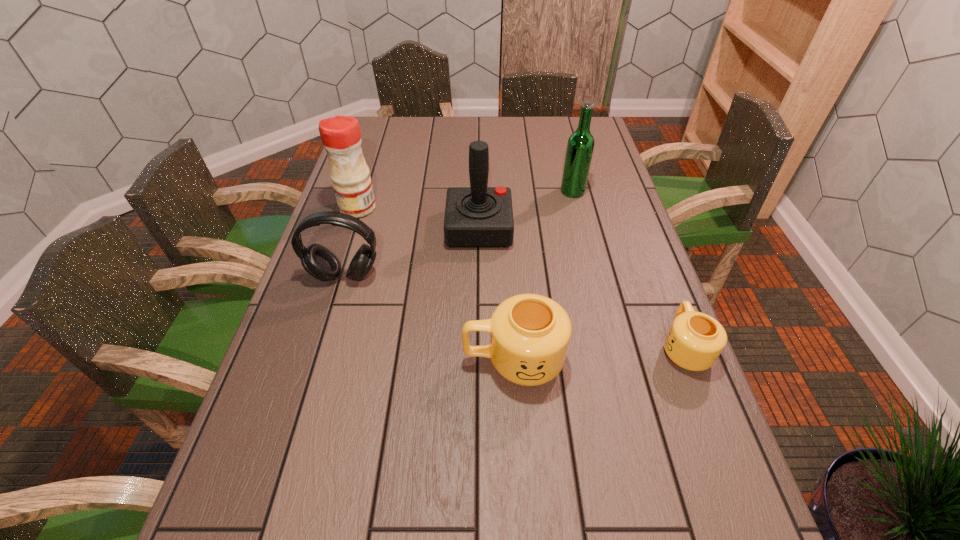
Image resolution: width=960 pixels, height=540 pixels. Identify the location of vacant space that is in between the joystick and the left mug. (496, 294).

Identify the location of vacant area that lies between the condiment and the second shortest object. (436, 284).

The height and width of the screenshot is (540, 960). I want to click on vacant point located between the joystick and the shortest object, so click(582, 288).

The height and width of the screenshot is (540, 960). I want to click on free space between the beer bottle and the rightmost object, so click(628, 269).

What are the coordinates of `free space that is in between the joystick and the fourth farthest object` in the screenshot? It's located at (412, 252).

What are the coordinates of `vacant area that lies between the taller mug and the condiment` in the screenshot? It's located at (436, 284).

Where is `empty space between the condiment and the headset`? This screenshot has width=960, height=540. empty space between the condiment and the headset is located at coordinates (351, 242).

Select which object is the third closest to the joystick. Please provide its 2D coordinates. Your answer should be formatted as a tuple, i.e. [(x, y)], where the tuple contains the x and y coordinates of a point satisfying the conditions above.

[(341, 137)]

Choose which object is the second nearest neighbor to the taller mug. Please provide its 2D coordinates. Your answer should be formatted as a tuple, i.e. [(x, y)], where the tuple contains the x and y coordinates of a point satisfying the conditions above.

[(318, 261)]

Image resolution: width=960 pixels, height=540 pixels. Identify the location of free spot that satisfies the following two spatial constraints: 1. on the base of the joystick; 2. on the earcups of the third nearest object. (479, 276).